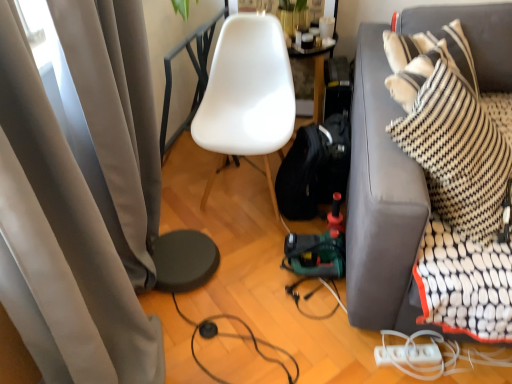
The height and width of the screenshot is (384, 512). I want to click on vacant area situated to the left side of white plastic extension cord at lower right, so click(355, 355).